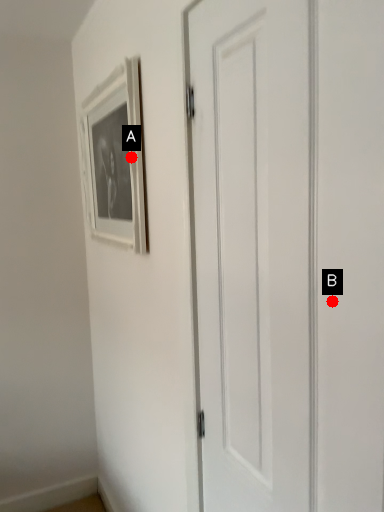
Question: Two points are circled on the image, labeled by A and B beside each circle. Which point appears farthest from the camera in this image?

Choices:
 (A) A is further
 (B) B is further

Answer: (A)